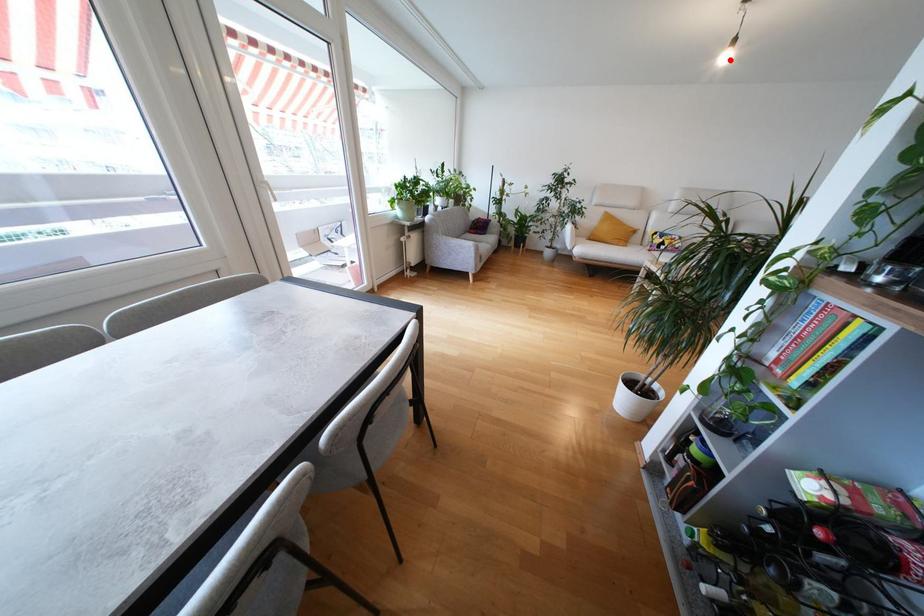
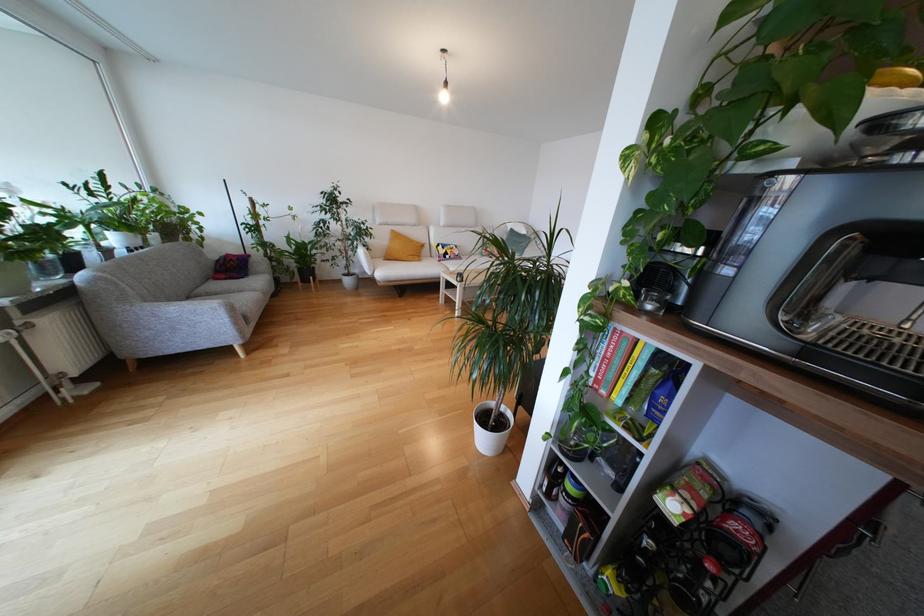
In the second image, find the point that corresponds to the highlighted location in the first image.

(448, 100)